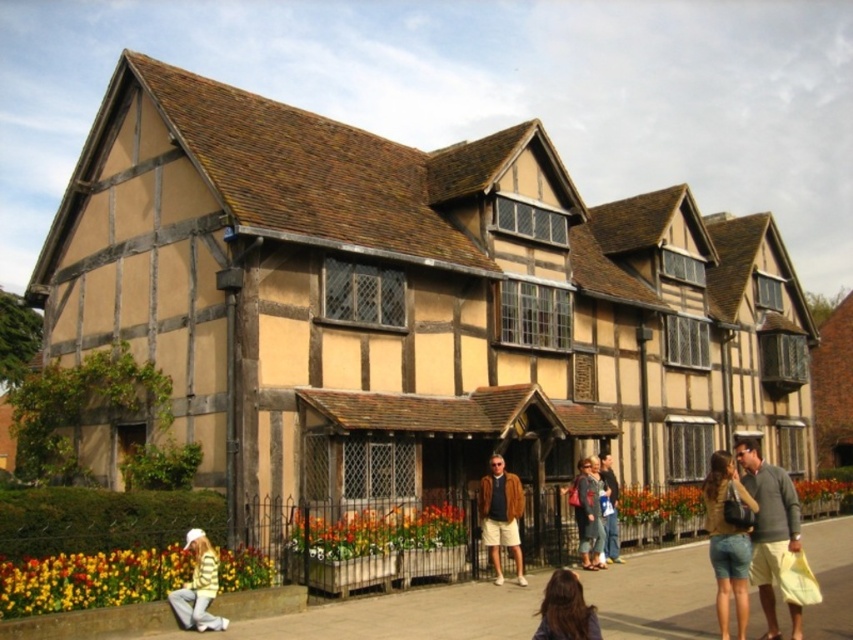
You are standing at the point marked as point (317, 616) in the image. Based on the scene description, what type of surface are you currently standing on?

The point (317, 616) is on paved concrete sidewalk at lower center, so you are standing on a paved concrete sidewalk.

You are a delivery person carrying a large package and need to walk from the street to the building entrance. The paved concrete sidewalk at lower center and the denim jacket at lower right are in your path. Which object should you avoid stepping on to ensure your package stays clean?

You should avoid stepping on the denim jacket at lower right because the paved concrete sidewalk at lower center is bigger and more suitable for walking without damaging the package.

You are standing in front of the traditional half timbered building and want to walk from point A to point B. The coordinates for point A are point (798,500) and point B are point (734,560). Since you can only move forward, will you pass through point B before reaching point A?

Point (798,500) is behind point (734,560). So, you will pass through point B before reaching point A.